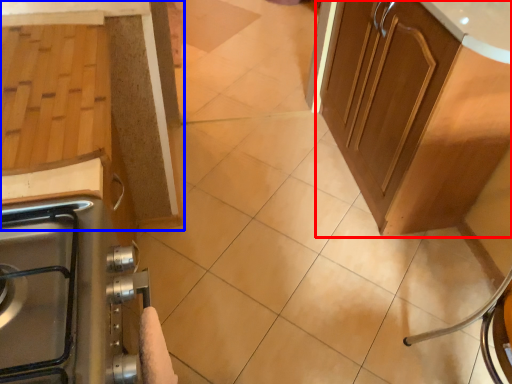
Question: Which object appears closest to the camera in this image, cabinetry (highlighted by a red box) or cabinetry (highlighted by a blue box)?

Choices:
 (A) cabinetry
 (B) cabinetry

Answer: (B)